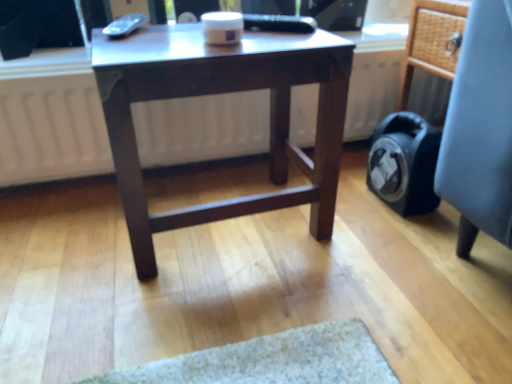
What do you see at coordinates (219, 93) in the screenshot? The image size is (512, 384). I see `dark brown wood table at center` at bounding box center [219, 93].

What is the approximate height of dark brown wood table at center?

It is 18.46 inches.

Identify the location of dark brown wood table at center. (219, 93).

Locate an element on the screen. The image size is (512, 384). light blue fabric chair at right is located at coordinates (480, 129).

Image resolution: width=512 pixels, height=384 pixels. What do you see at coordinates (480, 129) in the screenshot?
I see `light blue fabric chair at right` at bounding box center [480, 129].

Where is `dark brown wood table at center`? dark brown wood table at center is located at coordinates (219, 93).

Based on their positions, is light blue fabric chair at right located to the left or right of dark brown wood table at center?

Based on their positions, light blue fabric chair at right is located to the right of dark brown wood table at center.

Which is in front, light blue fabric chair at right or dark brown wood table at center?

Positioned in front is dark brown wood table at center.

Between point (504, 164) and point (145, 219), which one is positioned behind?

The point (145, 219) is behind.

From the image's perspective, does light blue fabric chair at right appear lower than dark brown wood table at center?

No, from the image's perspective, light blue fabric chair at right is not below dark brown wood table at center.

From a real-world perspective, is light blue fabric chair at right located higher than dark brown wood table at center?

Incorrect, from a real-world perspective, light blue fabric chair at right is lower than dark brown wood table at center.

Can you confirm if light blue fabric chair at right is wider than dark brown wood table at center?

Correct, the width of light blue fabric chair at right exceeds that of dark brown wood table at center.

Can you confirm if light blue fabric chair at right is taller than dark brown wood table at center?

Correct, light blue fabric chair at right is much taller as dark brown wood table at center.

Considering the relative sizes of light blue fabric chair at right and dark brown wood table at center in the image provided, is light blue fabric chair at right bigger than dark brown wood table at center?

No.

Is dark brown wood table at center completely or partially inside light blue fabric chair at right?

No, dark brown wood table at center is located outside of light blue fabric chair at right.

Would you consider light blue fabric chair at right to be distant from dark brown wood table at center?

That's not correct — light blue fabric chair at right is a little close to dark brown wood table at center.

Is light blue fabric chair at right turned away from dark brown wood table at center?

No, light blue fabric chair at right's orientation is not away from dark brown wood table at center.

How many degrees apart are the facing directions of light blue fabric chair at right and dark brown wood table at center?

There is a 91.3-degree angle between the facing directions of light blue fabric chair at right and dark brown wood table at center.

At what (x,y) coordinates should I click in order to perform the action: click on computer chair that is above the dark brown wood table at center (from the image's perspective). Please return your answer as a coordinate pair (x, y). Image resolution: width=512 pixels, height=384 pixels. Looking at the image, I should click on click(x=480, y=129).

Which is more to the right, dark brown wood table at center or light blue fabric chair at right?

light blue fabric chair at right.

Relative to light blue fabric chair at right, is dark brown wood table at center in front or behind?

dark brown wood table at center is in front of light blue fabric chair at right.

Is point (120, 73) less distant than point (509, 169)?

Yes, point (120, 73) is closer to viewer.

Based on the photo, from the image's perspective, is dark brown wood table at center below light blue fabric chair at right?

Yes, from the image's perspective, dark brown wood table at center is beneath light blue fabric chair at right.

Looking at this image, from a real-world perspective, who is located lower, dark brown wood table at center or light blue fabric chair at right?

In real-world perspective, light blue fabric chair at right is lower.

Between dark brown wood table at center and light blue fabric chair at right, which one has larger width?

light blue fabric chair at right.

Does dark brown wood table at center have a greater height compared to light blue fabric chair at right?

In fact, dark brown wood table at center may be shorter than light blue fabric chair at right.

Considering the sizes of dark brown wood table at center and light blue fabric chair at right in the image, is dark brown wood table at center bigger or smaller than light blue fabric chair at right?

Considering their sizes, dark brown wood table at center takes up more space than light blue fabric chair at right.

Is light blue fabric chair at right located within dark brown wood table at center?

That's incorrect, light blue fabric chair at right is not inside dark brown wood table at center.

Is the surface of dark brown wood table at center in direct contact with light blue fabric chair at right?

No.

In the scene shown: Is dark brown wood table at center looking in the opposite direction of light blue fabric chair at right?

No, dark brown wood table at center is not facing away from light blue fabric chair at right.

The height and width of the screenshot is (384, 512). I want to click on table in front of the light blue fabric chair at right, so click(x=219, y=93).

Where is `computer chair located underneath the dark brown wood table at center (from a real-world perspective)`? The image size is (512, 384). computer chair located underneath the dark brown wood table at center (from a real-world perspective) is located at coordinates (480, 129).

The width and height of the screenshot is (512, 384). What are the coordinates of `computer chair that is behind the dark brown wood table at center` in the screenshot? It's located at (480, 129).